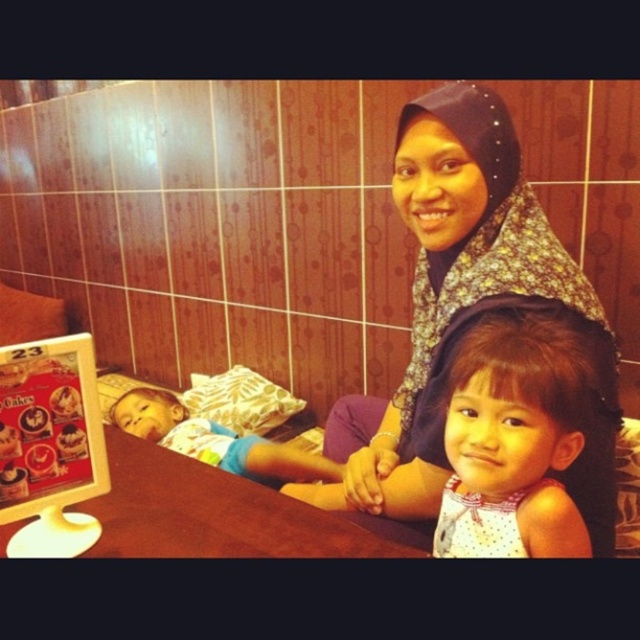
You are a photographer setting up a shot in this indoor scene. You notice a point at coordinates (515, 438). What is located at that point?

The point at (515, 438) is where the light brown hair at center is located.

You are organizing a clothing donation drive and need to determine which item takes up more space when folded. Based on the image, which item is wider between the patterned fabric hijab at upper center and the light blue cotton shirt at left?

The patterned fabric hijab at upper center is less wide than the light blue cotton shirt at left, so the light blue cotton shirt at left takes up more space when folded.

You are a furniture designer observing the scene. You need to determine if a decorative vase that requires a surface height of 1 meter can be placed on the brown wooden table at center. Can it fit based on the table height compared to the light blue cotton shirt at left?

The brown wooden table at center is shorter than the light blue cotton shirt at left. Since the table is shorter than the shirt, it is likely that the table is below 1 meter in height, so the decorative vase requiring a 1 meter surface may not fit properly.